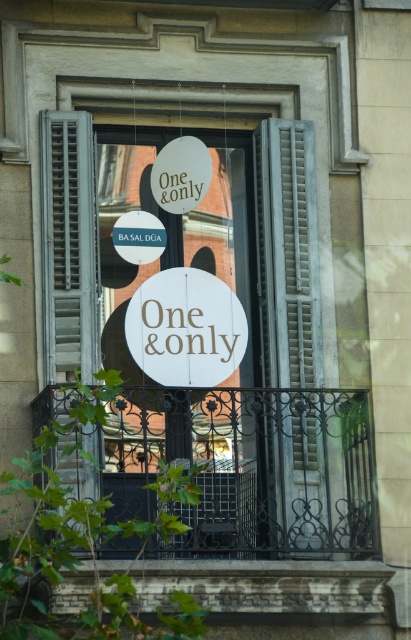
Question: Which is nearer to the gray textured shutter at right?

Choices:
 (A) white paper sign at center
 (B) white wood sign at center

Answer: (B)

Question: Which object is the closest to the white paper sign at center?

Choices:
 (A) gray textured shutter at right
 (B) white wood sign at center

Answer: (B)

Question: Is gray textured shutter at right closer to camera compared to white wood sign at center?

Choices:
 (A) yes
 (B) no

Answer: (B)

Question: Is gray textured shutter at right to the left of white wood sign at center from the viewer's perspective?

Choices:
 (A) no
 (B) yes

Answer: (A)

Question: Considering the real-world distances, which object is closest to the gray textured shutter at right?

Choices:
 (A) white wood sign at center
 (B) white paper sign at center

Answer: (A)

Question: Does white paper sign at center have a smaller size compared to white wood sign at center?

Choices:
 (A) no
 (B) yes

Answer: (A)